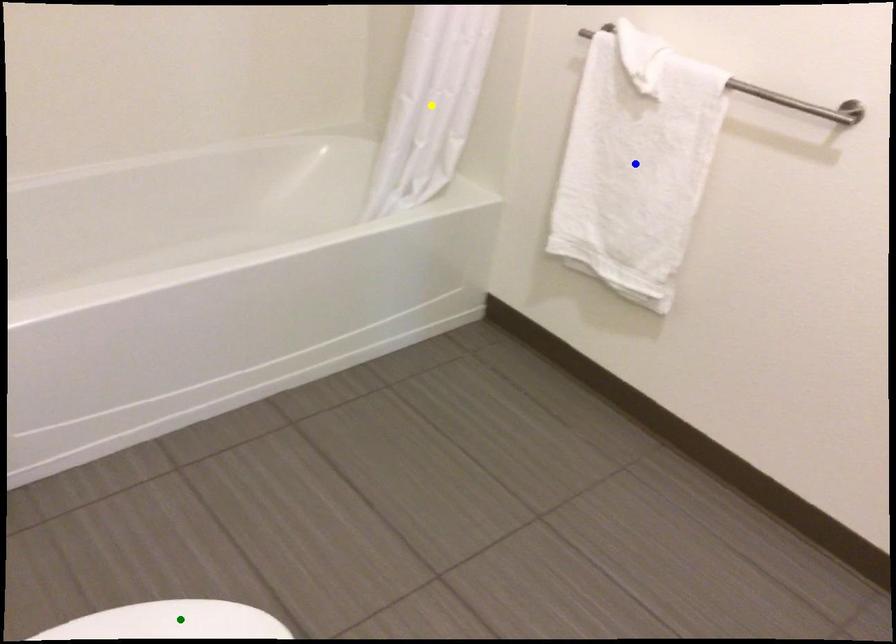
Based on the photo, order these from nearest to farthest:
A) green point
B) blue point
C) yellow point

green point
blue point
yellow point